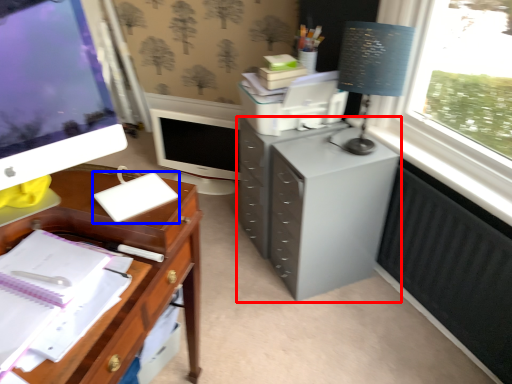
Question: Which object is further to the camera taking this photo, filing cabinet (highlighted by a red box) or notebook (highlighted by a blue box)?

Choices:
 (A) filing cabinet
 (B) notebook

Answer: (A)